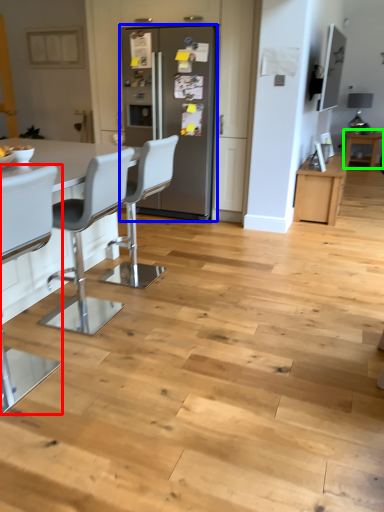
Question: Which object is the farthest from chair (highlighted by a red box)? Choose among these: fridge (highlighted by a blue box) or table (highlighted by a green box).

Choices:
 (A) fridge
 (B) table

Answer: (B)